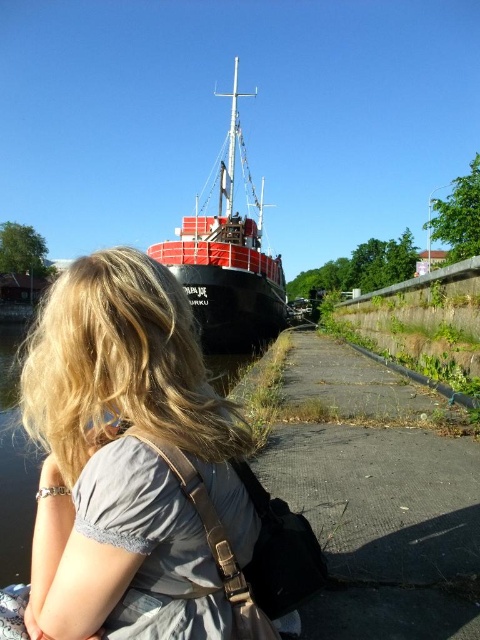
Is blonde hair at center bigger than red matte ship at center?

Incorrect, blonde hair at center is not larger than red matte ship at center.

Based on the photo, does blonde hair at center have a greater height compared to red matte ship at center?

In fact, blonde hair at center may be shorter than red matte ship at center.

Is point (62, 593) more distant than point (250, 269)?

That is False.

Find the location of a particular element. This screenshot has height=640, width=480. blonde hair at center is located at coordinates (120, 440).